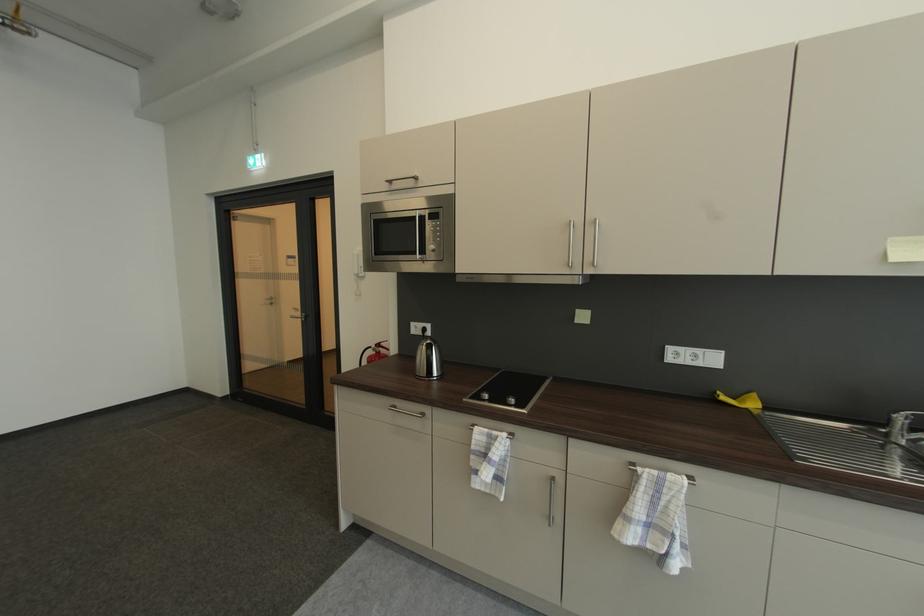
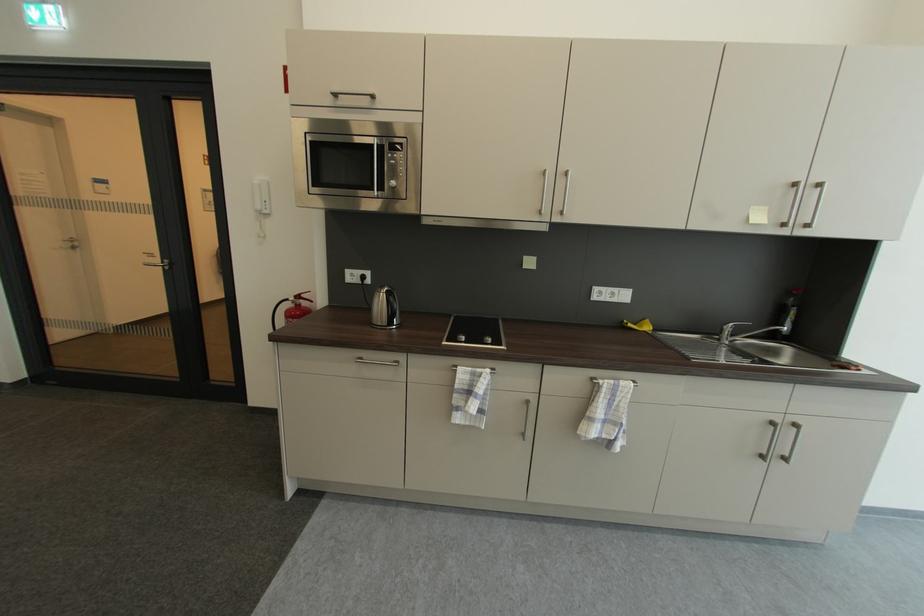
Find the pixel in the second image that matches point 305,315 in the first image.

(163, 262)